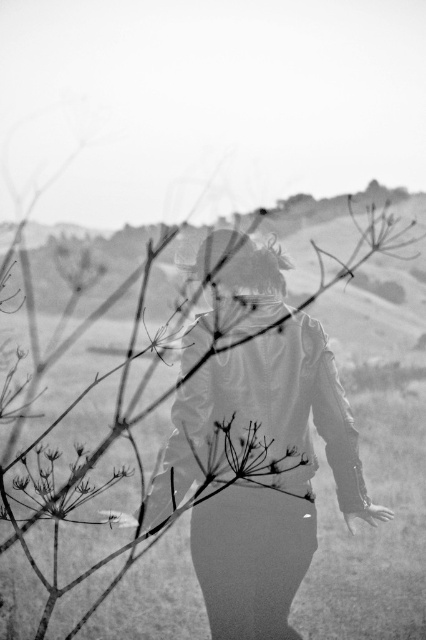
Does matte leather jacket at center have a lesser height compared to silvery metallic flower at lower left?

No.

Describe the element at coordinates (261, 474) in the screenshot. I see `matte leather jacket at center` at that location.

The image size is (426, 640). In order to click on matte leather jacket at center in this screenshot , I will do `click(261, 474)`.

Where is `matte leather jacket at center`? The height and width of the screenshot is (640, 426). matte leather jacket at center is located at coordinates (261, 474).